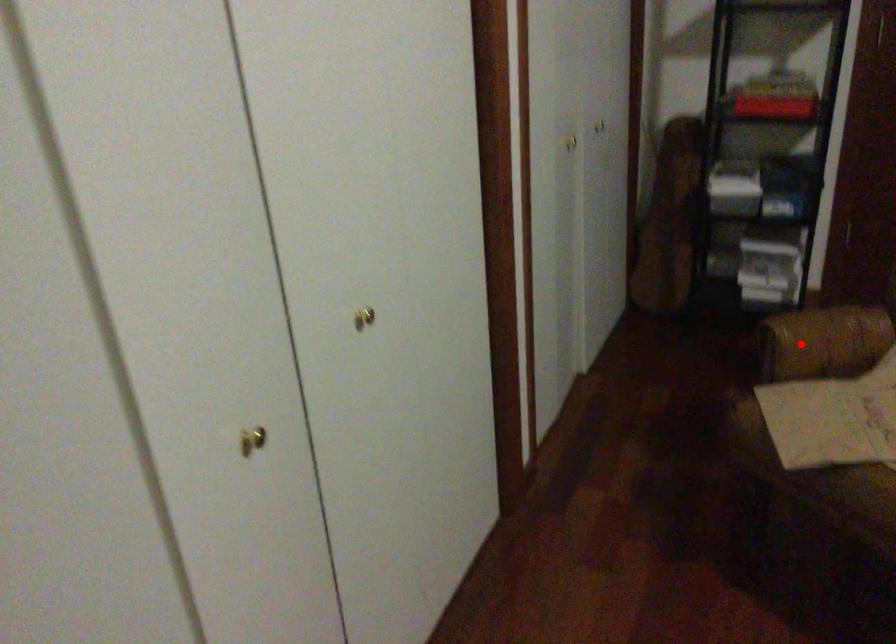
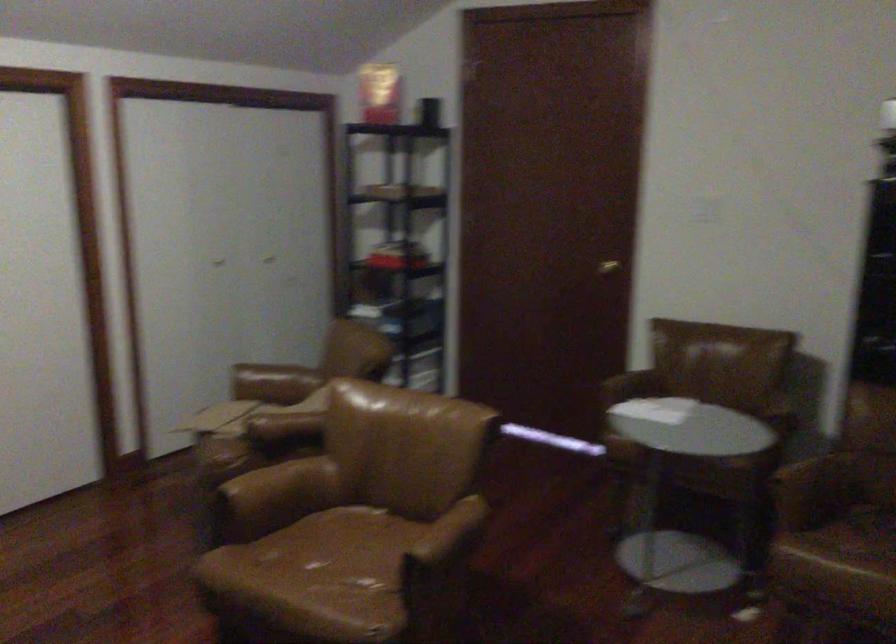
Locate, in the second image, the point that corresponds to the highlighted location in the first image.

(273, 383)